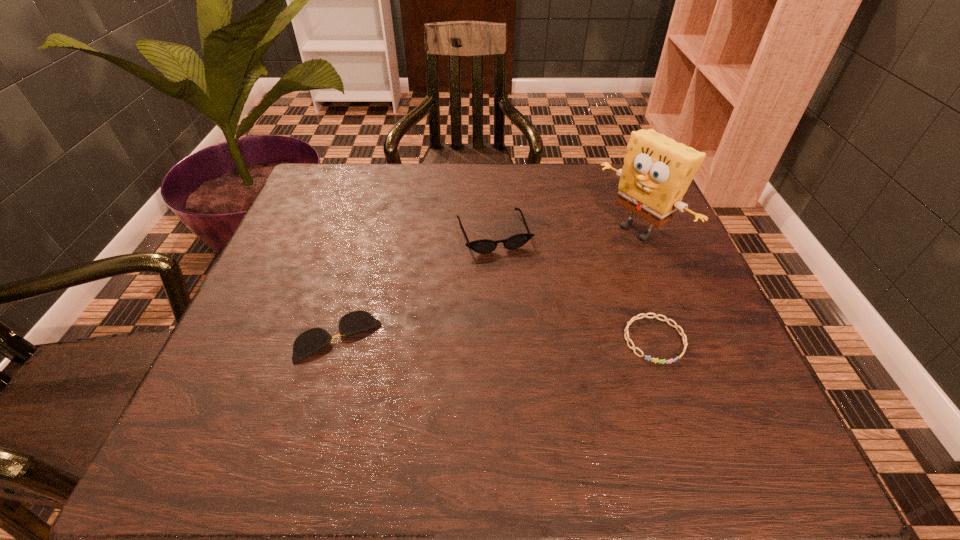
Find the location of a particular element. This screenshot has width=960, height=540. free location at the far right corner is located at coordinates (620, 207).

In the image, there is a desktop. Where is `free space at the near right corner`? free space at the near right corner is located at coordinates point(745,394).

This screenshot has width=960, height=540. Identify the location of vacant space in between the second shortest object and the sponge. (646, 285).

Locate an element on the screen. This screenshot has height=540, width=960. vacant space that is in between the tallest object and the shortest object is located at coordinates (489, 284).

This screenshot has width=960, height=540. In order to click on free spot between the third shortest object and the tallest object in this screenshot , I will do `click(565, 232)`.

Locate an element on the screen. The height and width of the screenshot is (540, 960). free space between the bracelet and the sponge is located at coordinates (646, 285).

The width and height of the screenshot is (960, 540). I want to click on free point between the tallest object and the shortest object, so click(489, 284).

Identify the location of free point between the spectacles and the sunglasses. (417, 285).

At what (x,y) coordinates should I click in order to perform the action: click on empty space between the tallest object and the second shortest object. Please return your answer as a coordinate pair (x, y). This screenshot has width=960, height=540. Looking at the image, I should click on (646, 285).

You are a GUI agent. You are given a task and a screenshot of the screen. Output one action in this format:
    pyautogui.click(x=<x>, y=<y>)
    Task: Click on the free space between the spectacles and the bracelet
    This screenshot has height=540, width=960.
    Given the screenshot: What is the action you would take?
    pyautogui.click(x=496, y=339)